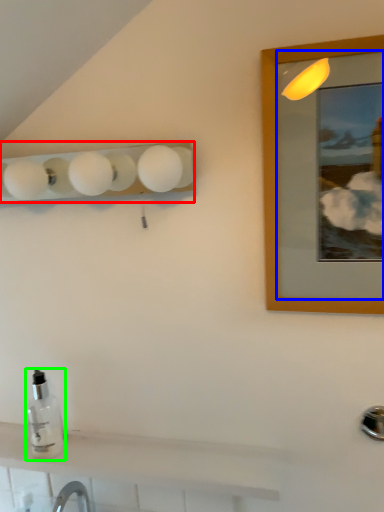
Question: Which object is the closest to the lamp (highlighted by a red box)? Choose among these: mirror (highlighted by a blue box) or bottle (highlighted by a green box).

Choices:
 (A) mirror
 (B) bottle

Answer: (A)